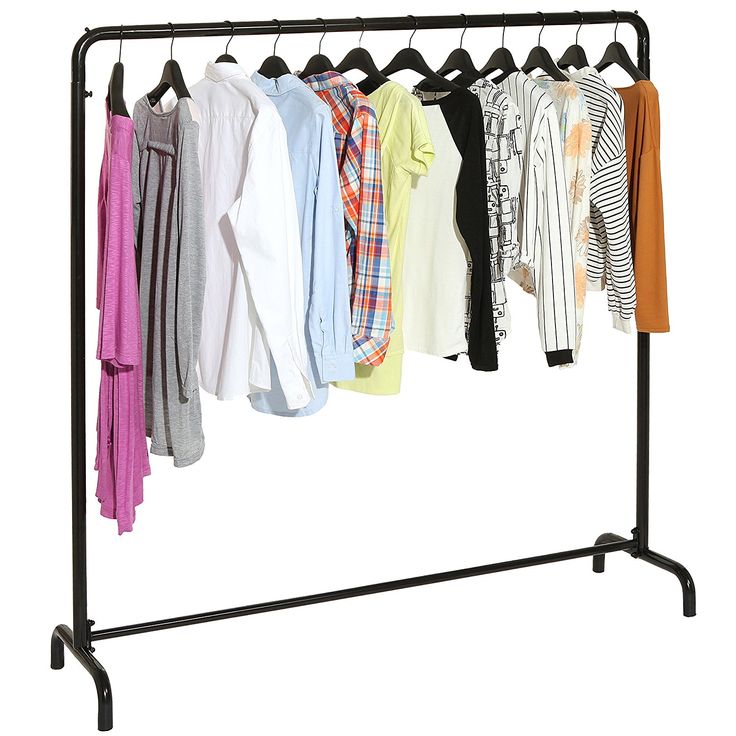
Where is `feet of the clothing rack`? feet of the clothing rack is located at coordinates (690, 601), (598, 564), (102, 712), (54, 657).